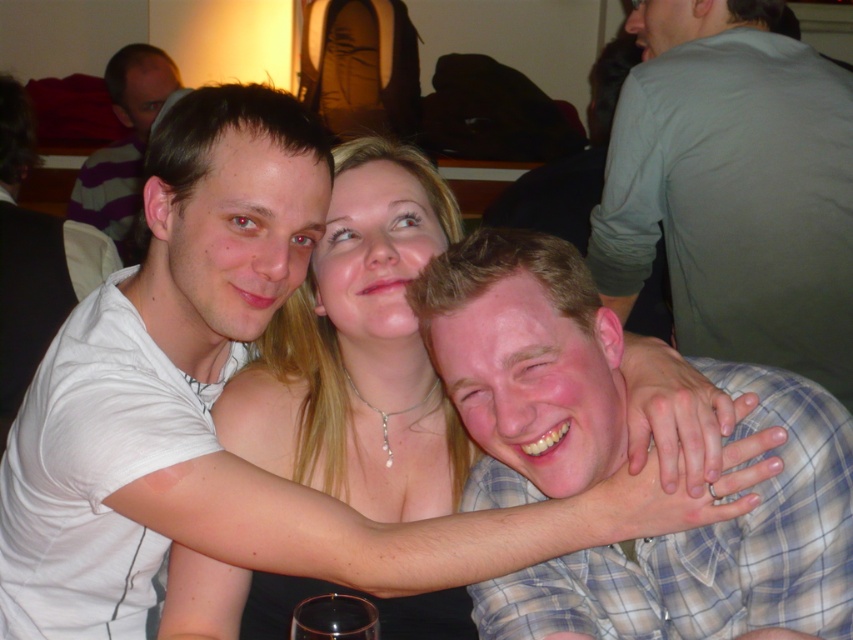
Is gray fabric shirt at upper right wider than matte white shirt at left?

Yes.

Describe the element at coordinates (570, 163) in the screenshot. I see `gray fabric shirt at upper right` at that location.

At what (x,y) coordinates should I click in order to perform the action: click on gray fabric shirt at upper right. Please return your answer as a coordinate pair (x, y). This screenshot has height=640, width=853. Looking at the image, I should click on (570, 163).

Locate an element on the screen. This screenshot has height=640, width=853. gray fabric shirt at upper right is located at coordinates (570, 163).

Does green cotton shirt at right have a larger size compared to gray fabric shirt at upper right?

No, green cotton shirt at right is not bigger than gray fabric shirt at upper right.

Between point (766, 273) and point (592, 161), which one is positioned behind?

The point (592, 161) is behind.

I want to click on green cotton shirt at right, so click(x=733, y=189).

Find the location of `light brown plaid shirt at center`. light brown plaid shirt at center is located at coordinates [714, 547].

Can you confirm if light brown plaid shirt at center is taller than gray fabric shirt at upper right?

No, light brown plaid shirt at center is not taller than gray fabric shirt at upper right.

I want to click on light brown plaid shirt at center, so [x=714, y=547].